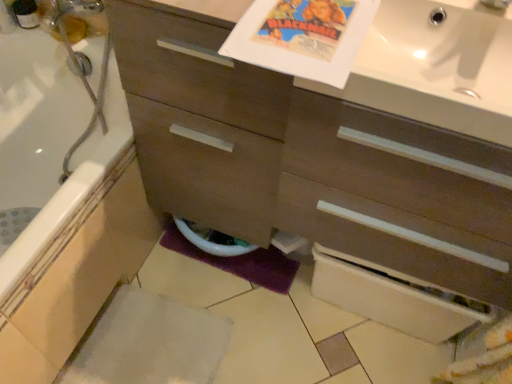
What do you see at coordinates (211, 243) in the screenshot?
I see `white glossy toilet bowl at lower center` at bounding box center [211, 243].

This screenshot has height=384, width=512. I want to click on matte brown cabinet at center, so click(x=317, y=175).

This screenshot has height=384, width=512. Describe the element at coordinates (63, 208) in the screenshot. I see `white glossy bathtub at lower left` at that location.

Identify the location of white glossy toilet bowl at lower center. The image size is (512, 384). (211, 243).

Is white glossy toilet bowl at lower center positioned far away from white glossy sink at upper right?

No, there isn't a large distance between white glossy toilet bowl at lower center and white glossy sink at upper right.

In the scene shown: From their relative heights in the image, would you say white glossy toilet bowl at lower center is taller or shorter than white glossy sink at upper right?

In the image, white glossy toilet bowl at lower center appears to be taller than white glossy sink at upper right.

From the image's perspective, is white glossy toilet bowl at lower center below white glossy sink at upper right?

Correct, white glossy toilet bowl at lower center appears lower than white glossy sink at upper right in the image.

Does white glossy toilet bowl at lower center come in front of white glossy sink at upper right?

No, the depth of white glossy toilet bowl at lower center is greater than that of white glossy sink at upper right.

Is white glossy toilet bowl at lower center with matte brown cabinet at center?

No, white glossy toilet bowl at lower center is not in contact with matte brown cabinet at center.

Where is `toilet bowl to the left of matte brown cabinet at center`? toilet bowl to the left of matte brown cabinet at center is located at coordinates (211, 243).

Is white glossy toilet bowl at lower center oriented away from matte brown cabinet at center?

Yes.

Which is farther from the camera, (x=206, y=244) or (x=335, y=303)?

Positioned behind is point (x=335, y=303).

Could you tell me if white glossy bathtub at lower left is turned towards white glossy sink at upper right?

No, white glossy bathtub at lower left is not oriented towards white glossy sink at upper right.

Can you see white glossy bathtub at lower left touching white glossy sink at upper right?

No, white glossy bathtub at lower left is not next to white glossy sink at upper right.

How different are the orientations of white glossy bathtub at lower left and white glossy sink at upper right in degrees?

90 degrees.

Which is correct: white glossy bathtub at lower left is inside white glossy sink at upper right, or outside of it?

white glossy bathtub at lower left is not enclosed by white glossy sink at upper right.

From a real-world perspective, which is physically below, white glossy sink at upper right or matte brown cabinet at center?

matte brown cabinet at center, from a real-world perspective.

Identify the location of bathroom cabinet lying in front of the white glossy sink at upper right. (317, 175).

Is point (444, 79) closer to camera compared to point (167, 109)?

Yes, point (444, 79) is in front of point (167, 109).

Considering the sizes of objects white glossy sink at upper right and matte brown cabinet at center in the image provided, who is thinner, white glossy sink at upper right or matte brown cabinet at center?

With smaller width is matte brown cabinet at center.

From the image's perspective, which one is positioned lower, matte brown cabinet at center or white glossy bathtub at lower left?

white glossy bathtub at lower left.

Considering the positions of objects matte brown cabinet at center and white glossy bathtub at lower left in the image provided, who is more to the left, matte brown cabinet at center or white glossy bathtub at lower left?

From the viewer's perspective, white glossy bathtub at lower left appears more on the left side.

Consider the image. Which is correct: matte brown cabinet at center is inside white glossy bathtub at lower left, or outside of it?

matte brown cabinet at center is spatially situated outside white glossy bathtub at lower left.

Locate an element on the screen. This screenshot has height=384, width=512. bathroom cabinet located in front of the white glossy bathtub at lower left is located at coordinates (317, 175).

Where is `bath lying in front of the white glossy toilet bowl at lower center`? bath lying in front of the white glossy toilet bowl at lower center is located at coordinates (63, 208).

From a real-world perspective, is white glossy toilet bowl at lower center above or below white glossy bathtub at lower left?

In terms of real-world spatial position, white glossy toilet bowl at lower center is below white glossy bathtub at lower left.

Is white glossy toilet bowl at lower center inside or outside of white glossy bathtub at lower left?

white glossy toilet bowl at lower center lies outside white glossy bathtub at lower left.

Find the location of a particular element. This screenshot has height=384, width=512. bath above the white glossy toilet bowl at lower center (from the image's perspective) is located at coordinates (63, 208).

Could you tell me if white glossy bathtub at lower left is turned towards white glossy toilet bowl at lower center?

Yes, white glossy bathtub at lower left is oriented towards white glossy toilet bowl at lower center.

How many degrees apart are the facing directions of white glossy bathtub at lower left and white glossy toilet bowl at lower center?

The angular difference between white glossy bathtub at lower left and white glossy toilet bowl at lower center is 90 degrees.

Where is `sink in front of the white glossy toilet bowl at lower center`? The height and width of the screenshot is (384, 512). sink in front of the white glossy toilet bowl at lower center is located at coordinates (442, 52).

This screenshot has height=384, width=512. In the image, there is a matte brown cabinet at center. In order to click on toilet bowl below it (from the image's perspective) in this screenshot , I will do `click(211, 243)`.

From the image, which object appears to be farther from white glossy sink at upper right, white glossy toilet bowl at lower center or matte brown cabinet at center?

white glossy toilet bowl at lower center is further to white glossy sink at upper right.

Based on their spatial positions, is white glossy sink at upper right or white glossy toilet bowl at lower center further from matte brown cabinet at center?

Among the two, white glossy toilet bowl at lower center is located further to matte brown cabinet at center.

When comparing their distances from white glossy sink at upper right, does white glossy bathtub at lower left or white glossy toilet bowl at lower center seem closer?

Among the two, white glossy toilet bowl at lower center is located nearer to white glossy sink at upper right.

From the image, which object appears to be nearer to white glossy bathtub at lower left, matte brown cabinet at center or white glossy toilet bowl at lower center?

white glossy toilet bowl at lower center is positioned closer to the anchor white glossy bathtub at lower left.

When comparing their distances from white glossy toilet bowl at lower center, does matte brown cabinet at center or white glossy bathtub at lower left seem further?

Among the two, matte brown cabinet at center is located further to white glossy toilet bowl at lower center.

Estimate the real-world distances between objects in this image. Which object is further from white glossy toilet bowl at lower center, white glossy bathtub at lower left or white glossy sink at upper right?

The object further to white glossy toilet bowl at lower center is white glossy sink at upper right.

From the image, which object appears to be farther from white glossy bathtub at lower left, white glossy toilet bowl at lower center or matte brown cabinet at center?

matte brown cabinet at center lies further to white glossy bathtub at lower left than the other object.

Based on their spatial positions, is white glossy bathtub at lower left or matte brown cabinet at center further from white glossy toilet bowl at lower center?

matte brown cabinet at center.

Find the location of a particular element. Image resolution: width=512 pixels, height=384 pixels. bathroom cabinet between white glossy bathtub at lower left and white glossy sink at upper right from left to right is located at coordinates (317, 175).

At what (x,y) coordinates should I click in order to perform the action: click on sink between matte brown cabinet at center and white glossy toilet bowl at lower center along the z-axis. Please return your answer as a coordinate pair (x, y). Image resolution: width=512 pixels, height=384 pixels. Looking at the image, I should click on (442, 52).

At what (x,y) coordinates should I click in order to perform the action: click on toilet bowl between white glossy bathtub at lower left and white glossy sink at upper right from left to right. Please return your answer as a coordinate pair (x, y). Looking at the image, I should click on (211, 243).

Where is `toilet bowl between white glossy bathtub at lower left and matte brown cabinet at center`? The width and height of the screenshot is (512, 384). toilet bowl between white glossy bathtub at lower left and matte brown cabinet at center is located at coordinates (211, 243).